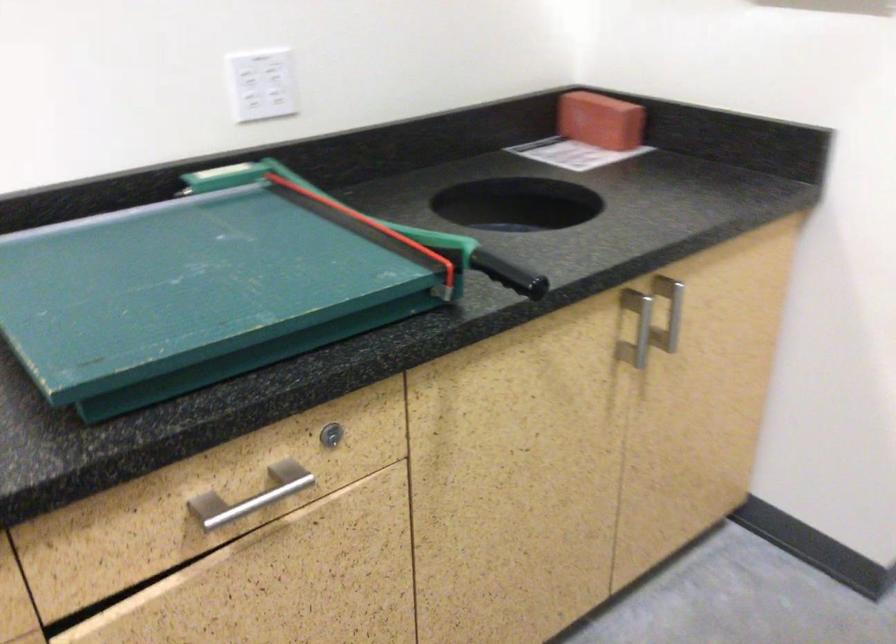
Where is `silver drawer handle`? The image size is (896, 644). silver drawer handle is located at coordinates (251, 496).